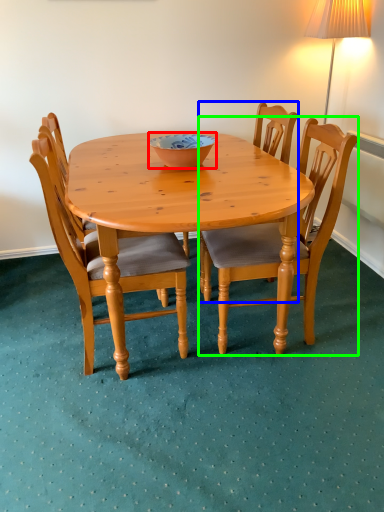
Question: Which is nearer to the bowl (highlighted by a red box)? chair (highlighted by a blue box) or chair (highlighted by a green box).

Choices:
 (A) chair
 (B) chair

Answer: (A)